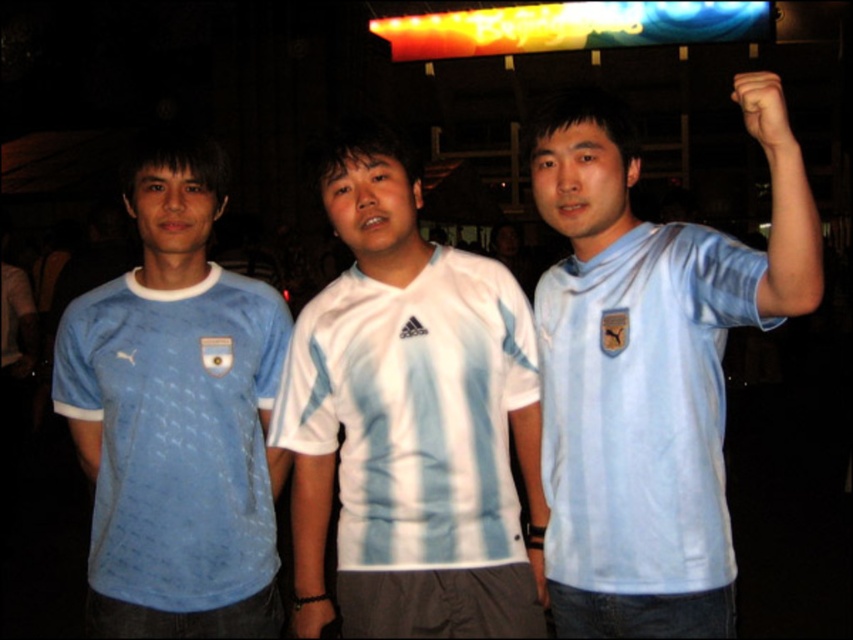
Question: Does light blue jersey at center come behind matte blue jersey at left?

Choices:
 (A) no
 (B) yes

Answer: (A)

Question: Is white matte jersey at center above matte blue jersey at left?

Choices:
 (A) yes
 (B) no

Answer: (A)

Question: Which point is farther from the camera taking this photo?

Choices:
 (A) pyautogui.click(x=276, y=422)
 (B) pyautogui.click(x=720, y=516)
 (C) pyautogui.click(x=70, y=326)

Answer: (C)

Question: Does light blue jersey at center appear over black matte hand at upper right?

Choices:
 (A) no
 (B) yes

Answer: (A)

Question: Estimate the real-world distances between objects in this image. Which object is closer to the white matte jersey at center?

Choices:
 (A) light blue jersey at center
 (B) black matte hand at upper right
 (C) matte blue jersey at left

Answer: (C)

Question: Which object appears closest to the camera in this image?

Choices:
 (A) matte blue jersey at left
 (B) black matte hand at upper right
 (C) light blue jersey at center
 (D) white matte jersey at center

Answer: (C)